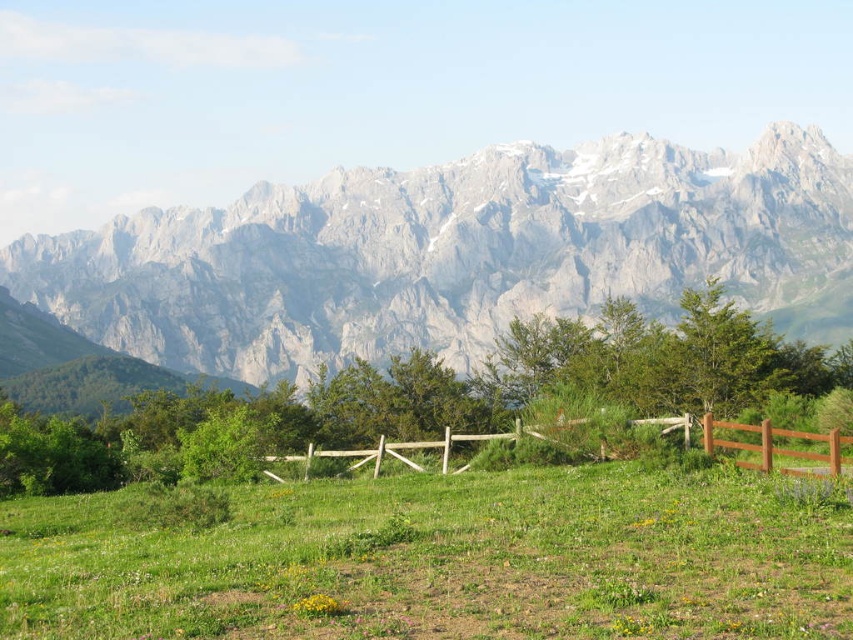
Question: Which point is farther to the camera?

Choices:
 (A) brown wooden fence at center
 (B) gray rocky mountain range at upper center
 (C) green grassy pasture at center

Answer: (B)

Question: Does gray rocky mountain range at upper center have a greater width compared to green grassy pasture at center?

Choices:
 (A) no
 (B) yes

Answer: (B)

Question: Based on their relative distances, which object is nearer to the brown wooden fence at center?

Choices:
 (A) gray rocky mountain range at upper center
 (B) green grassy pasture at center

Answer: (B)

Question: From the image, what is the correct spatial relationship of gray rocky mountain range at upper center in relation to brown wooden fence at center?

Choices:
 (A) right
 (B) left

Answer: (B)

Question: Which point is closer to the camera?

Choices:
 (A) green grassy pasture at center
 (B) brown wooden fence at center
 (C) gray rocky mountain range at upper center

Answer: (A)

Question: Is green grassy pasture at center positioned before brown wooden fence at center?

Choices:
 (A) no
 (B) yes

Answer: (B)